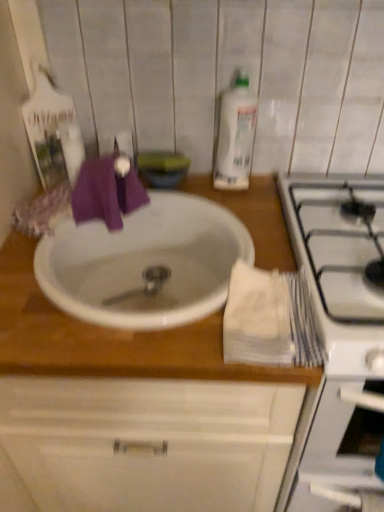
Question: Considering the relative sizes of white glossy stove at right and white matte sink at center in the image provided, is white glossy stove at right bigger than white matte sink at center?

Choices:
 (A) no
 (B) yes

Answer: (A)

Question: Considering the relative sizes of white glossy stove at right and white matte sink at center in the image provided, is white glossy stove at right wider than white matte sink at center?

Choices:
 (A) no
 (B) yes

Answer: (B)

Question: From the image's perspective, is white glossy stove at right under white matte sink at center?

Choices:
 (A) no
 (B) yes

Answer: (B)

Question: From a real-world perspective, is white glossy stove at right physically below white matte sink at center?

Choices:
 (A) no
 (B) yes

Answer: (B)

Question: Does white glossy stove at right have a smaller size compared to white matte sink at center?

Choices:
 (A) yes
 (B) no

Answer: (A)

Question: From the image's perspective, is white glossy stove at right on top of white matte sink at center?

Choices:
 (A) yes
 (B) no

Answer: (B)

Question: Is white glossy stove at right bigger than white glossy sink at center?

Choices:
 (A) no
 (B) yes

Answer: (B)

Question: From a real-world perspective, is white glossy stove at right beneath white glossy sink at center?

Choices:
 (A) yes
 (B) no

Answer: (A)

Question: Considering the relative positions of white glossy stove at right and white glossy sink at center in the image provided, is white glossy stove at right to the left of white glossy sink at center from the viewer's perspective?

Choices:
 (A) yes
 (B) no

Answer: (B)

Question: Considering the relative sizes of white glossy stove at right and white glossy sink at center in the image provided, is white glossy stove at right taller than white glossy sink at center?

Choices:
 (A) no
 (B) yes

Answer: (B)

Question: Considering the relative sizes of white glossy stove at right and white glossy sink at center in the image provided, is white glossy stove at right smaller than white glossy sink at center?

Choices:
 (A) yes
 (B) no

Answer: (B)

Question: From the image's perspective, does white glossy stove at right appear lower than white glossy sink at center?

Choices:
 (A) yes
 (B) no

Answer: (A)

Question: Is white glossy sink at center outside clear plastic bottle at upper center?

Choices:
 (A) no
 (B) yes

Answer: (B)